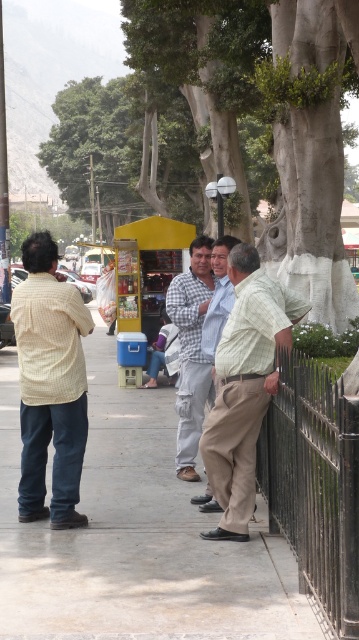
Is light yellow checkered shirt at left to the right of checkered fabric shirt at center from the viewer's perspective?

Incorrect, light yellow checkered shirt at left is not on the right side of checkered fabric shirt at center.

Is light yellow checkered shirt at left behind checkered fabric shirt at center?

That is False.

Find the location of a particular element. light yellow checkered shirt at left is located at coordinates (49, 385).

Is point (333, 524) farther from viewer compared to point (235, 260)?

No, it is in front of (235, 260).

Image resolution: width=359 pixels, height=640 pixels. Identify the location of black wrought iron fence at lower right. (314, 483).

Between checkered fabric shirt at center and light blue shirt at center, which one appears on the left side from the viewer's perspective?

checkered fabric shirt at center is more to the left.

Does checkered fabric shirt at center appear under light blue shirt at center?

Indeed, checkered fabric shirt at center is positioned under light blue shirt at center.

Measure the distance between checkered fabric shirt at center and camera.

The distance of checkered fabric shirt at center from camera is 7.86 meters.

This screenshot has width=359, height=640. In order to click on checkered fabric shirt at center in this screenshot , I will do `click(192, 352)`.